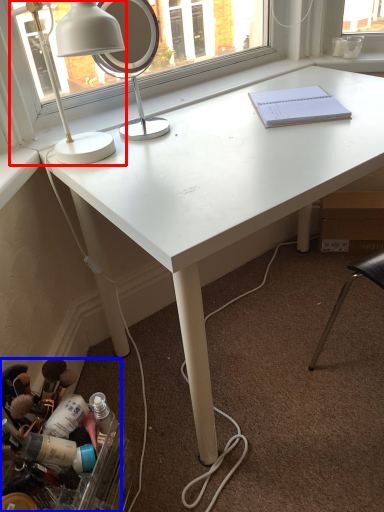
Question: Which object is further to the camera taking this photo, lamp (highlighted by a red box) or toiletry (highlighted by a blue box)?

Choices:
 (A) lamp
 (B) toiletry

Answer: (A)